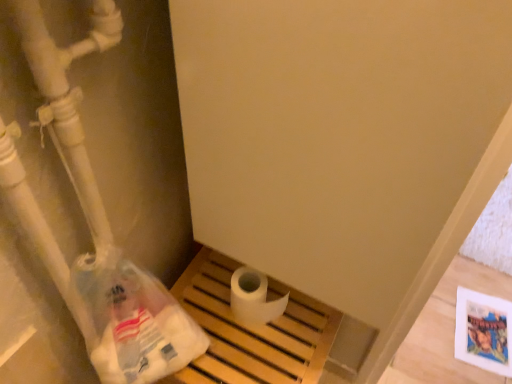
Image resolution: width=512 pixels, height=384 pixels. I want to click on vacant space situated on the left part of white matte toilet paper at center, so (207, 292).